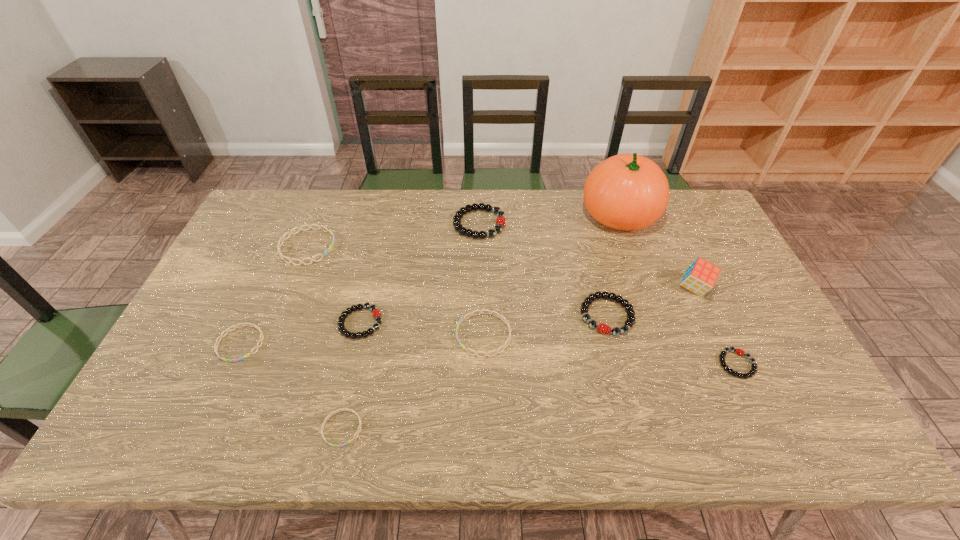
Image resolution: width=960 pixels, height=540 pixels. Identify the location of blank region between the biggest black bracelet and the tallest object. (549, 219).

In order to click on free space between the rightmost blue bracelet and the rightmost bracelet in this screenshot , I will do `click(611, 349)`.

Find the location of a particular element. free space between the third smallest blue bracelet and the rightmost black bracelet is located at coordinates (611, 349).

Where is `free space between the third biggest black bracelet and the shortest bracelet`? The height and width of the screenshot is (540, 960). free space between the third biggest black bracelet and the shortest bracelet is located at coordinates (351, 375).

Find the location of a particular element. This screenshot has width=960, height=540. free spot between the rightmost blue bracelet and the second biggest black bracelet is located at coordinates (545, 325).

Identify the location of vacant space in between the leftmost black bracelet and the second biggest blue bracelet. This screenshot has width=960, height=540. (422, 329).

Locate an element on the screen. the sixth closest object to the rightmost blue bracelet is located at coordinates (283, 238).

Find the location of a particular element. object that is the seventh nearest to the third biggest blue bracelet is located at coordinates (627, 192).

Choose which bracelet is the fourth nearest neighbor to the third biggest blue bracelet. Please provide its 2D coordinates. Your answer should be formatted as a tuple, i.e. [(x, y)], where the tuple contains the x and y coordinates of a point satisfying the conditions above.

[(506, 322)]

Select which bracelet appears as the sixth closest to the biggest blue bracelet. Please provide its 2D coordinates. Your answer should be formatted as a tuple, i.e. [(x, y)], where the tuple contains the x and y coordinates of a point satisfying the conditions above.

[(602, 328)]